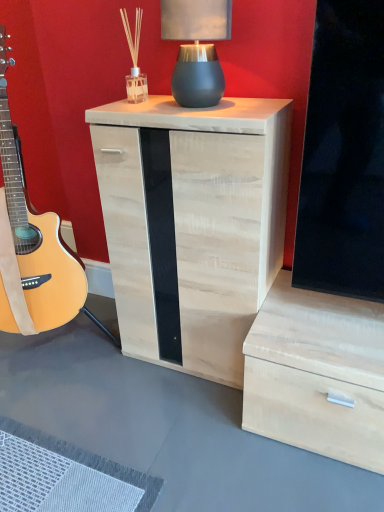
Question: Is natural wood guitar at left taller than light wood/texture nightstand at center?

Choices:
 (A) no
 (B) yes

Answer: (B)

Question: From a real-world perspective, is natural wood guitar at left on top of light wood/texture nightstand at center?

Choices:
 (A) no
 (B) yes

Answer: (B)

Question: Is natural wood guitar at left positioned beyond the bounds of light wood/texture nightstand at center?

Choices:
 (A) yes
 (B) no

Answer: (A)

Question: From a real-world perspective, is natural wood guitar at left below light wood/texture nightstand at center?

Choices:
 (A) yes
 (B) no

Answer: (B)

Question: Is natural wood guitar at left further to the viewer compared to light wood/texture nightstand at center?

Choices:
 (A) yes
 (B) no

Answer: (B)

Question: Does natural wood guitar at left have a lesser width compared to light wood/texture nightstand at center?

Choices:
 (A) yes
 (B) no

Answer: (B)

Question: Does matte gray ceramic table lamp at upper center have a lesser width compared to light wood/texture nightstand at center?

Choices:
 (A) no
 (B) yes

Answer: (B)

Question: Is matte gray ceramic table lamp at upper center to the left of light wood/texture nightstand at center from the viewer's perspective?

Choices:
 (A) no
 (B) yes

Answer: (A)

Question: Is matte gray ceramic table lamp at upper center aimed at light wood/texture nightstand at center?

Choices:
 (A) no
 (B) yes

Answer: (A)

Question: Is matte gray ceramic table lamp at upper center not within light wood/texture nightstand at center?

Choices:
 (A) yes
 (B) no

Answer: (A)

Question: Is light wood/texture nightstand at center inside matte gray ceramic table lamp at upper center?

Choices:
 (A) yes
 (B) no

Answer: (B)

Question: Is matte gray ceramic table lamp at upper center touching light wood/texture nightstand at center?

Choices:
 (A) no
 (B) yes

Answer: (A)

Question: Is natural wood guitar at left aimed at matte gray ceramic table lamp at upper center?

Choices:
 (A) no
 (B) yes

Answer: (A)